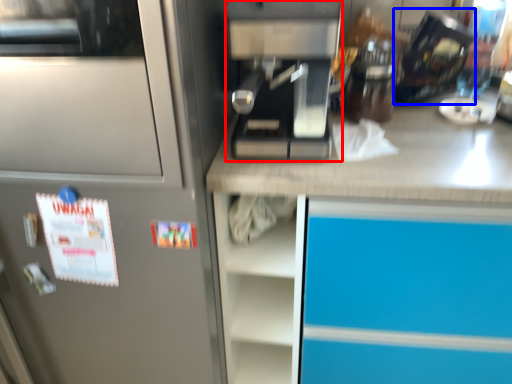
Question: Which object appears farthest to the camera in this image, kitchen appliance (highlighted by a red box) or appliance (highlighted by a blue box)?

Choices:
 (A) kitchen appliance
 (B) appliance

Answer: (B)